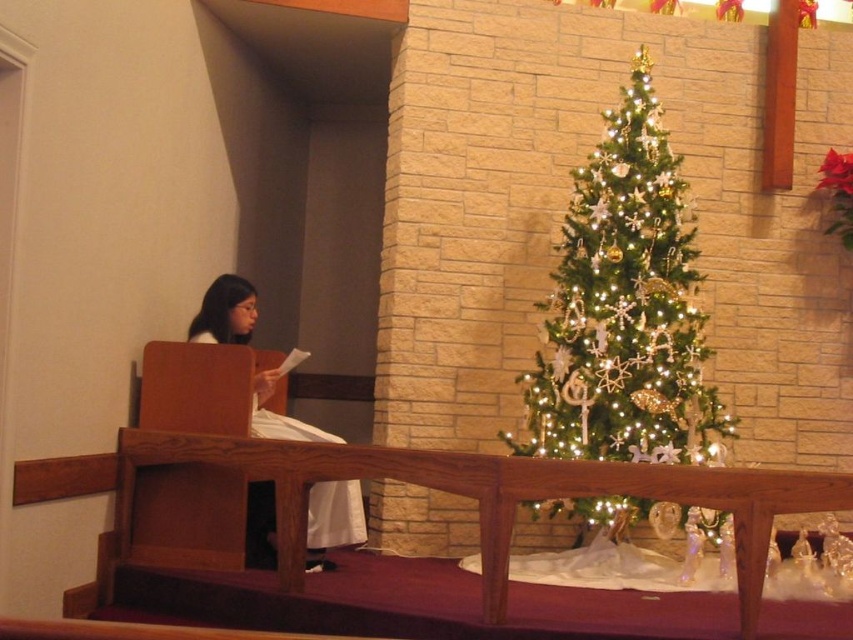
You are an attendee at the event and want to take a photo of the iridescent gold christmas tree at center without the white fabric at left being in the frame. Which direction should you move to achieve this?

The iridescent gold christmas tree at center is further to the viewer than the white fabric at left. To avoid the white fabric at left appearing in the frame, you should move to the right side so that the tree is positioned between you and the fabric.

You are an event planner setting up decorations for a Christmas event. You have the iridescent gold christmas tree at center and the white fabric at left. Based on the scene, which object is placed higher in the image?

The iridescent gold christmas tree at center is positioned over the white fabric at left, meaning it is placed higher than the white fabric at left.